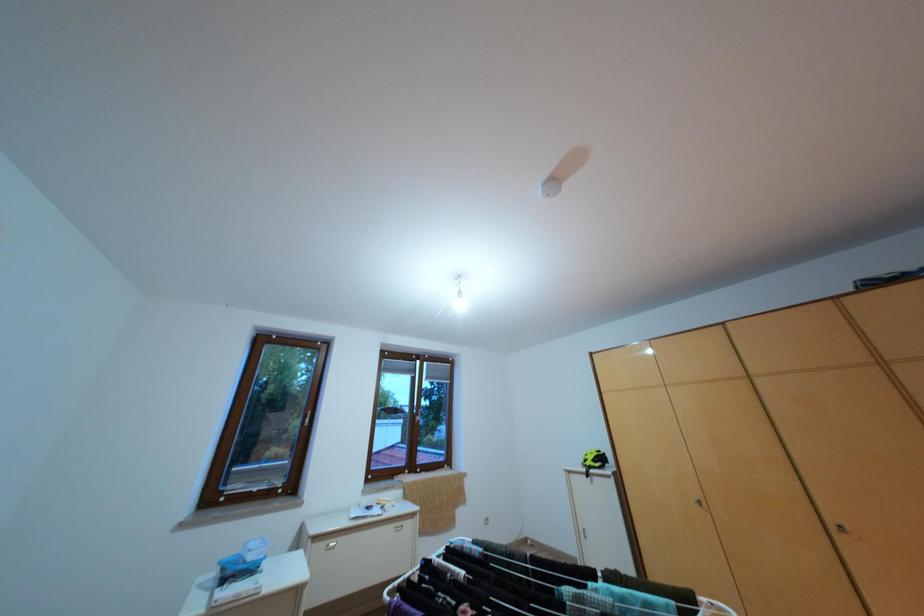
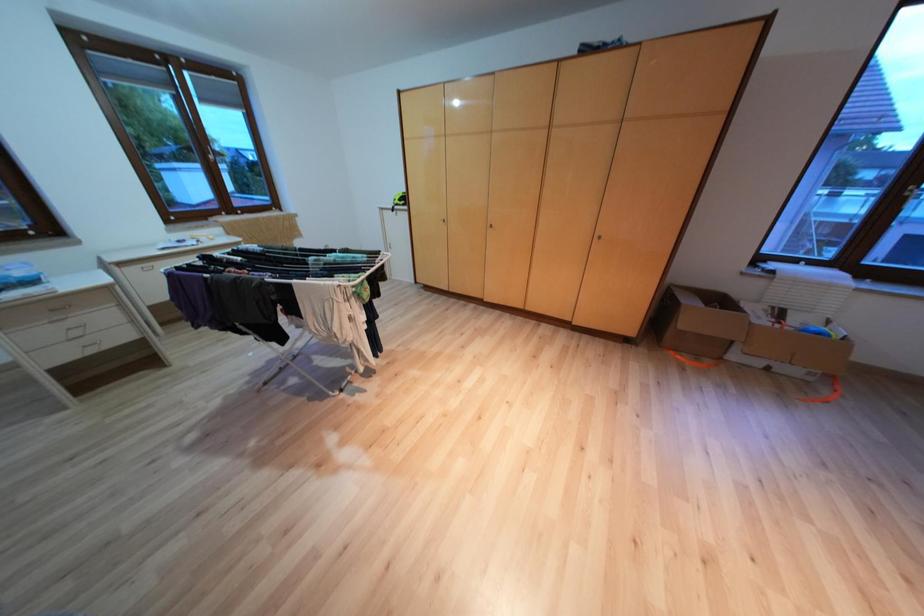
The first image is from the beginning of the video and the second image is from the end. How did the camera likely rotate when shooting the video?

The rotation direction of the camera is right-down.